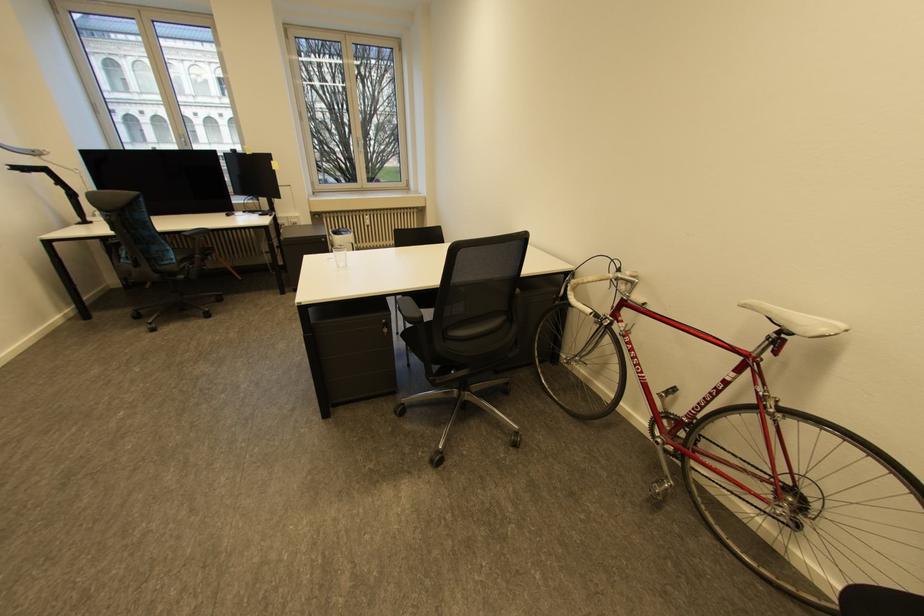
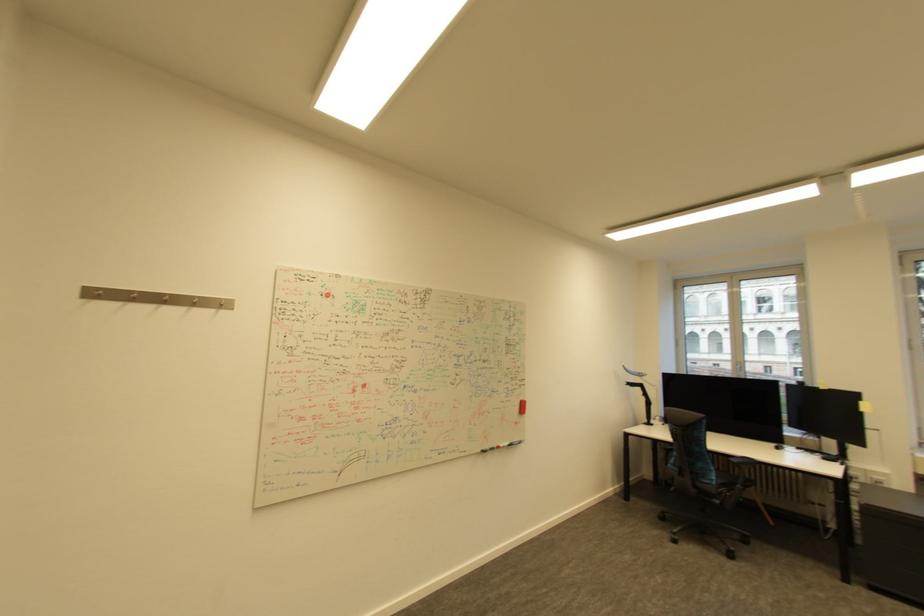
Question: Based on the continuous images, in which direction is the camera rotating? Reply with the corresponding letter.

Choices:
 (A) Left
 (B) Right
 (C) Up
 (D) Down

Answer: (A)